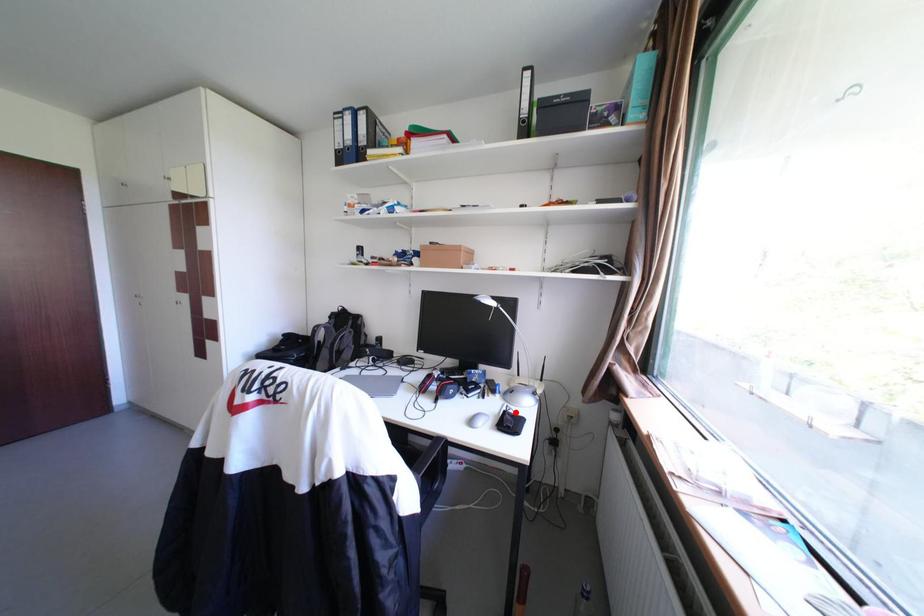
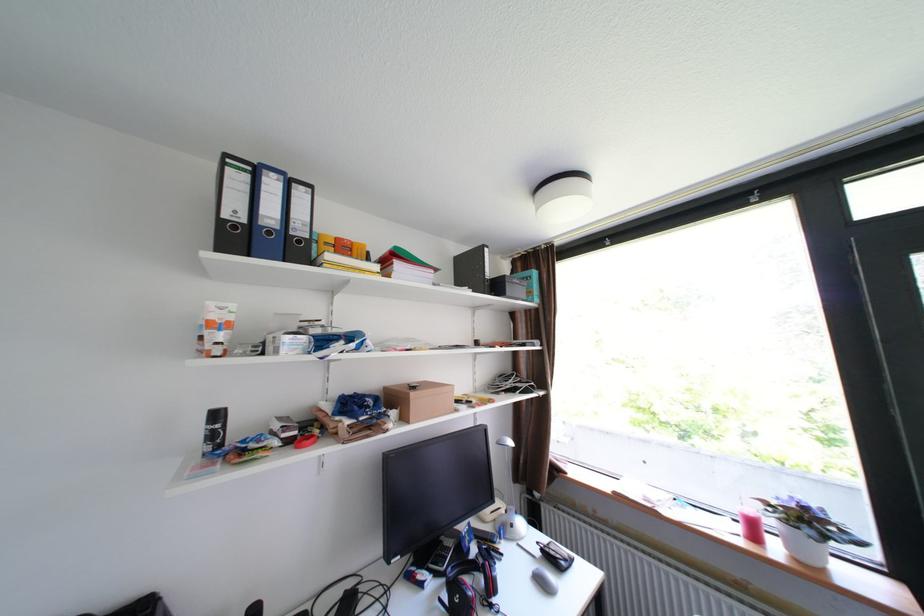
Question: I am providing you with two images of the same scene from different viewpoints. A red point is shown in image1. For the corresponding object point in image2, is it positioned nearer or farther from the camera?

Choices:
 (A) Nearer
 (B) Farther

Answer: (A)